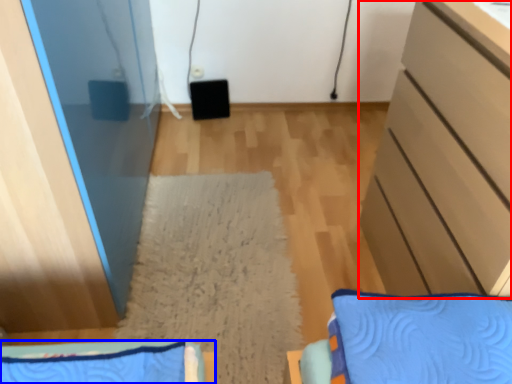
Question: Among these objects, which one is farthest to the camera, cabinetry (highlighted by a red box) or furniture (highlighted by a blue box)?

Choices:
 (A) cabinetry
 (B) furniture

Answer: (A)